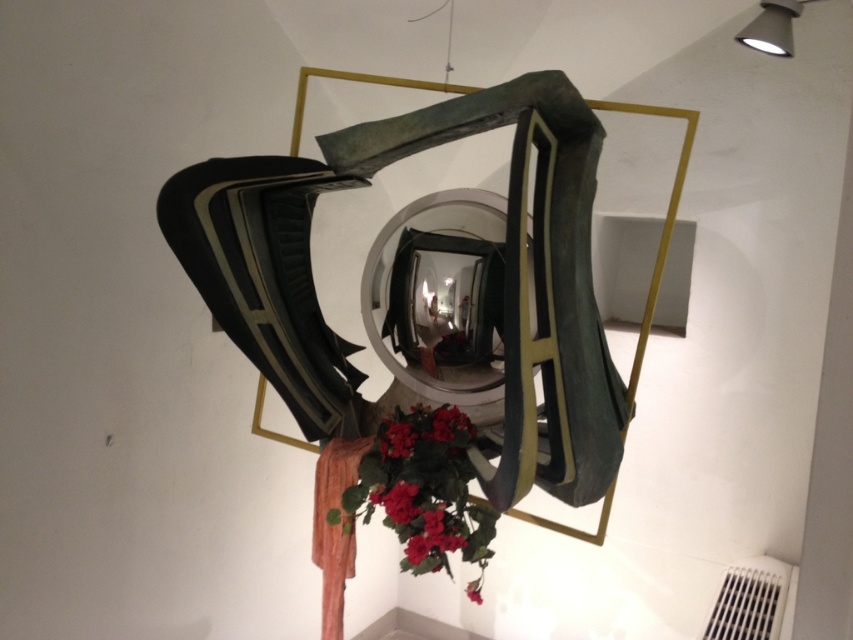
Is white plastic radiator at lower right below matte red flower at lower center?

Correct, white plastic radiator at lower right is located below matte red flower at lower center.

Identify the location of white plastic radiator at lower right. (749, 602).

Is point (779, 609) positioned after point (471, 589)?

Yes, point (779, 609) is behind point (471, 589).

Where is `white plastic radiator at lower right`? Image resolution: width=853 pixels, height=640 pixels. white plastic radiator at lower right is located at coordinates pos(749,602).

Between matte red flowers at lower center and matte red flower at lower center, which one has more height?

With more height is matte red flowers at lower center.

Does point (404, 419) come in front of point (469, 596)?

No, it is not.

Which is in front, point (467, 541) or point (479, 580)?

Point (467, 541) is in front.

At what (x,y) coordinates should I click in order to perform the action: click on matte red flowers at lower center. Please return your answer as a coordinate pair (x, y). The width and height of the screenshot is (853, 640). Looking at the image, I should click on (426, 492).

Is white plastic radiator at lower right thinner than vibrant matte red flowers at center?

In fact, white plastic radiator at lower right might be wider than vibrant matte red flowers at center.

Between point (721, 596) and point (397, 433), which one is positioned in front?

Positioned in front is point (397, 433).

Image resolution: width=853 pixels, height=640 pixels. I want to click on white plastic radiator at lower right, so click(749, 602).